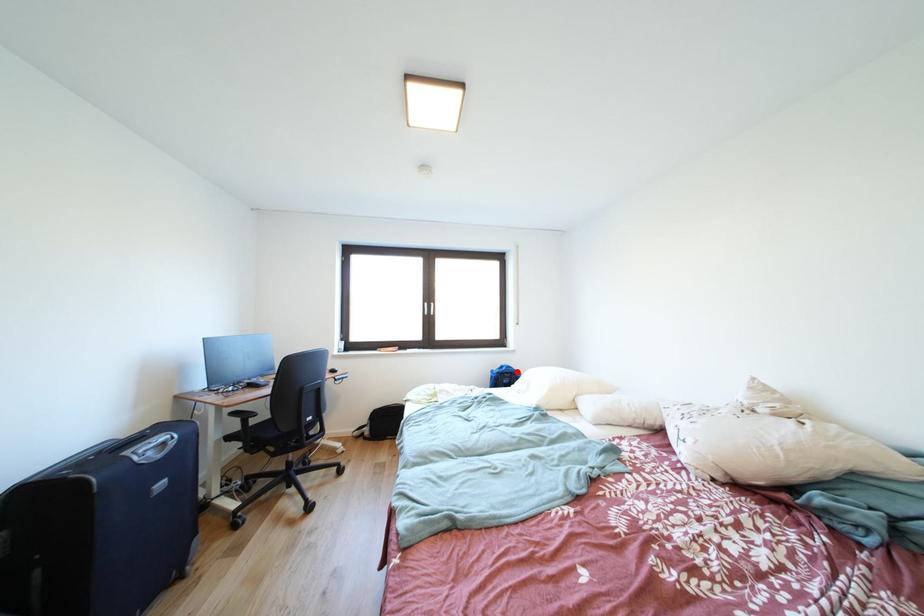
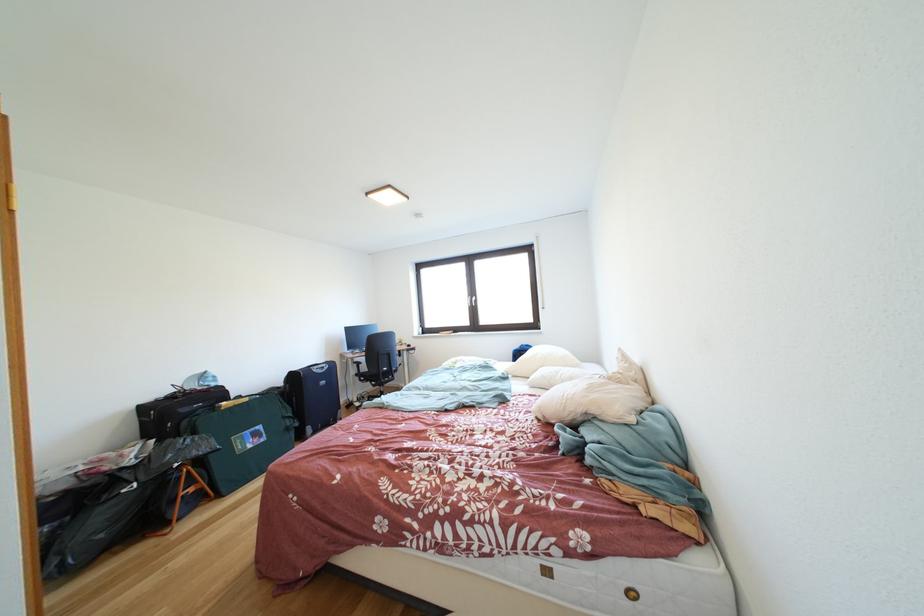
Locate, in the second image, the point that corresponds to the highlighted location in the first image.

(535, 351)